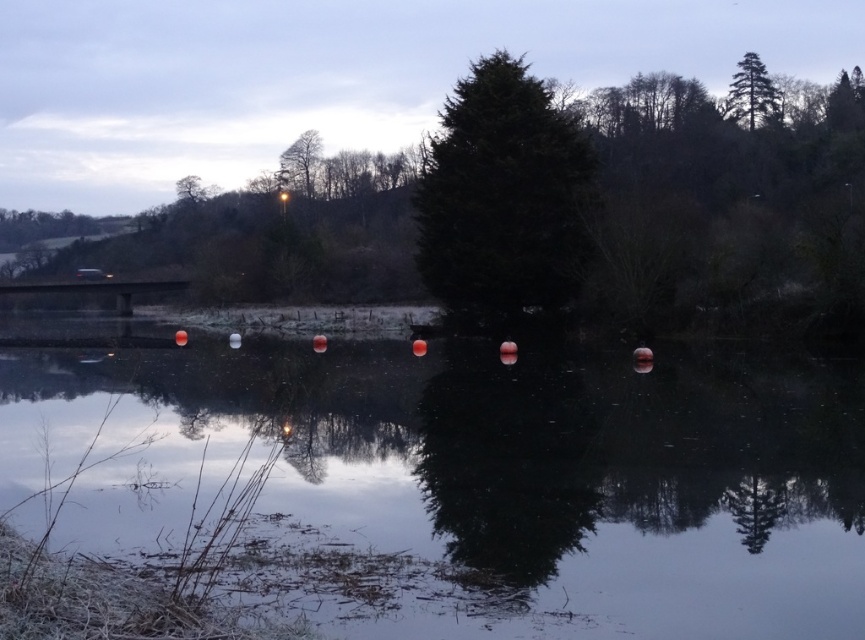
Locate an element on the screen. transparent glass river at center is located at coordinates click(x=473, y=481).

Does transparent glass river at center have a lesser width compared to green matte tree at upper left?

In fact, transparent glass river at center might be wider than green matte tree at upper left.

Is point (263, 556) positioned after point (42, 218)?

No, (263, 556) is in front of (42, 218).

Where is `transparent glass river at center`? transparent glass river at center is located at coordinates (473, 481).

Which is in front, point (42, 234) or point (745, 106)?

Point (745, 106) is in front.

Is green matte tree at upper left positioned before green textured pine tree at upper right?

No, it is not.

What do you see at coordinates (42, 227) in the screenshot?
I see `green matte tree at upper left` at bounding box center [42, 227].

You are a GUI agent. You are given a task and a screenshot of the screen. Output one action in this format:
    pyautogui.click(x=<x>, y=<y>)
    Task: Click on the green matte tree at upper left
    
    Given the screenshot: What is the action you would take?
    (42, 227)

Is transparent glass river at center below green textured pine tree at upper right?

Yes, transparent glass river at center is below green textured pine tree at upper right.

Identify the location of transparent glass river at center. This screenshot has width=865, height=640. (473, 481).